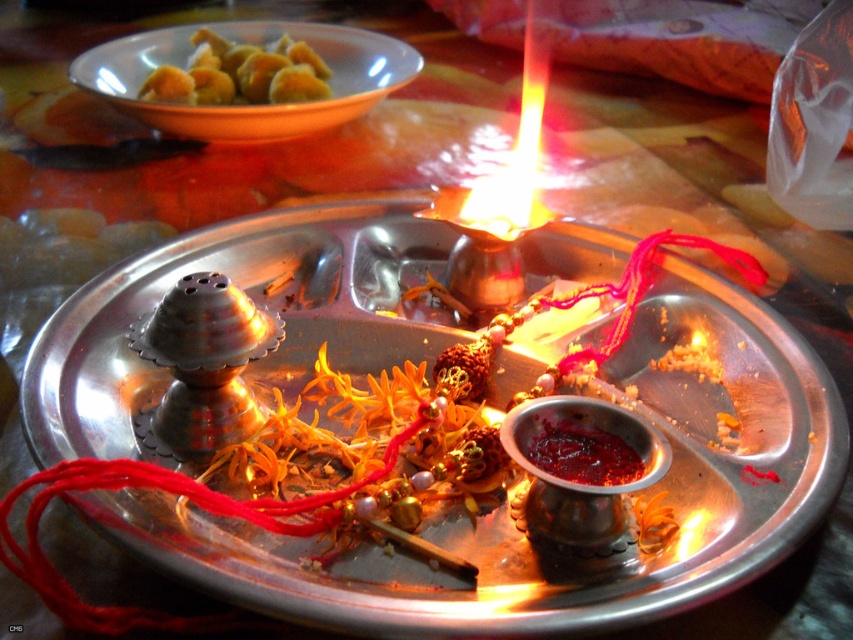
You are a guest at a traditional Indian puja ceremony and want to place a new offering between the golden fried dumplings at upper left and the shiny red paste at center. The offering is 12 inches long. Can you fit it between them?

The golden fried dumplings at upper left is 35.64 inches away from shiny red paste at center, so yes, the offering can fit between them since the distance is greater than the offering length.

What is the 2D coordinate of the metallic tray at center?

The metallic tray at center is located at the 2D coordinate point of (521, 534).

You are a guest at a traditional Indian puja ceremony and see the metallic tray at center and golden fried dumplings at upper left. Which object is taller?

The metallic tray at center is much taller than the golden fried dumplings at upper left.